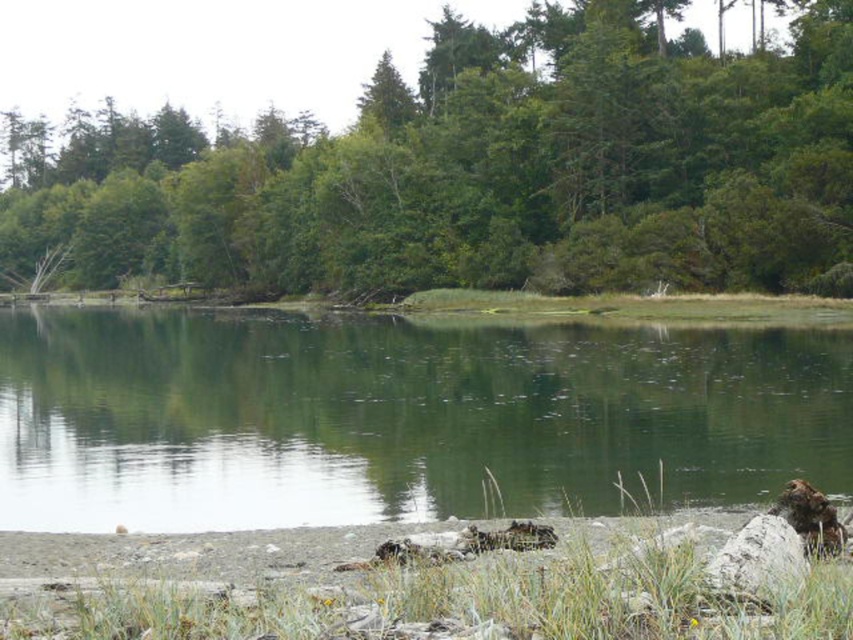
Question: Estimate the real-world distances between objects in this image. Which object is closer to the white smooth rock at lower right?

Choices:
 (A) green reflective water at center
 (B) green leafy tree at center

Answer: (A)

Question: Does green leafy tree at center have a larger size compared to white smooth rock at lower right?

Choices:
 (A) yes
 (B) no

Answer: (A)

Question: Which is nearer to the white smooth rock at lower right?

Choices:
 (A) green reflective water at center
 (B) green leafy tree at center

Answer: (A)

Question: Is green reflective water at center bigger than white smooth rock at lower right?

Choices:
 (A) no
 (B) yes

Answer: (B)

Question: Which object is farther from the camera taking this photo?

Choices:
 (A) white smooth rock at lower right
 (B) green leafy tree at center
 (C) green reflective water at center

Answer: (B)

Question: Is green leafy tree at center wider than white smooth rock at lower right?

Choices:
 (A) yes
 (B) no

Answer: (A)